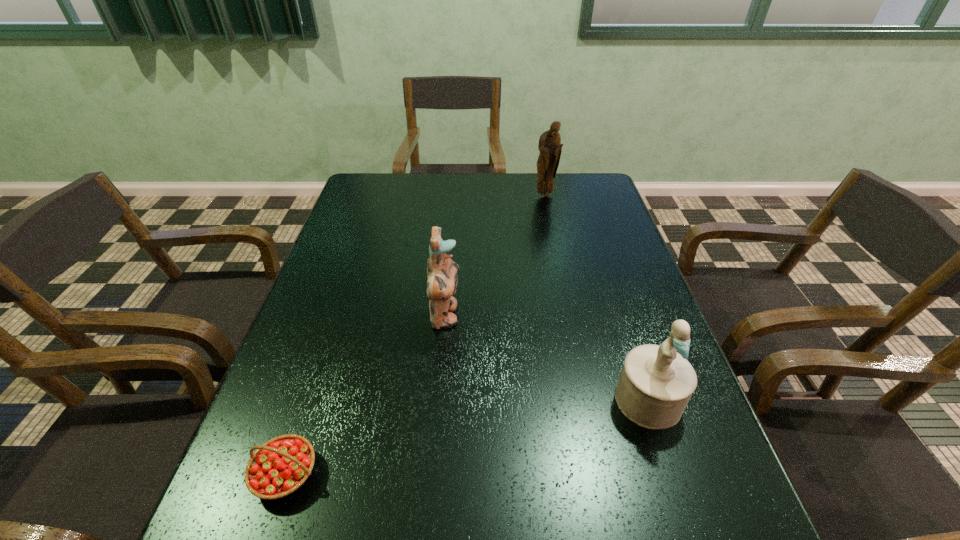
This screenshot has width=960, height=540. Identify the location of the second figurine from right to left. (550, 147).

Locate an element on the screen. the third object from left to right is located at coordinates (550, 147).

Identify the location of the leftmost figurine. The image size is (960, 540). (442, 272).

Identify the location of the second nearest figurine. (442, 272).

In order to click on the rightmost object in this screenshot , I will do `click(656, 383)`.

What are the coordinates of `the second nearest object` in the screenshot? It's located at (656, 383).

Where is `the nearest object`? the nearest object is located at coordinates click(279, 467).

The height and width of the screenshot is (540, 960). What are the coordinates of `the leftmost object` in the screenshot? It's located at [279, 467].

Identify the location of free space located 0.080m on the front-facing side of the farthest object. The height and width of the screenshot is (540, 960). coord(548,211).

Where is `free space located on the front-facing side of the leftmost figurine`? free space located on the front-facing side of the leftmost figurine is located at coordinates tap(490, 316).